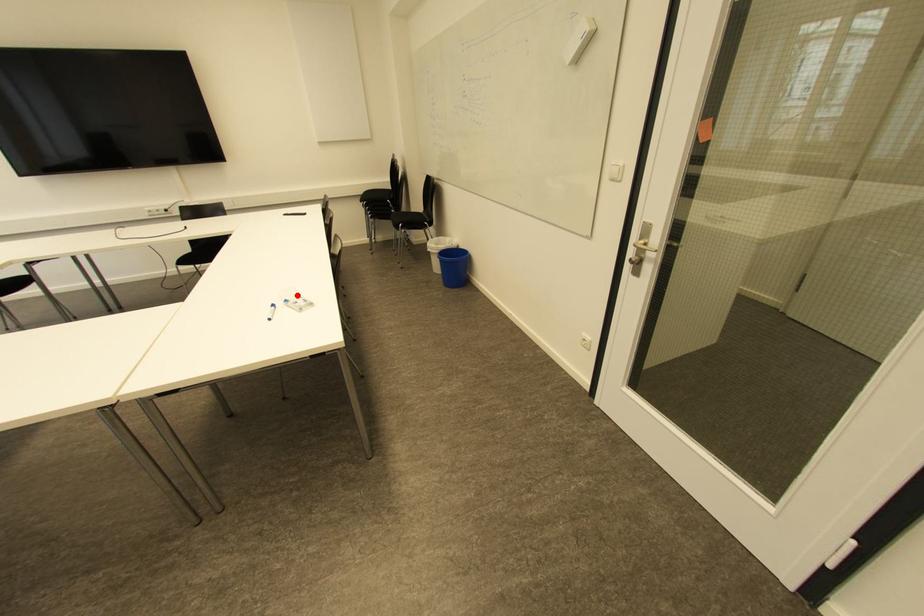
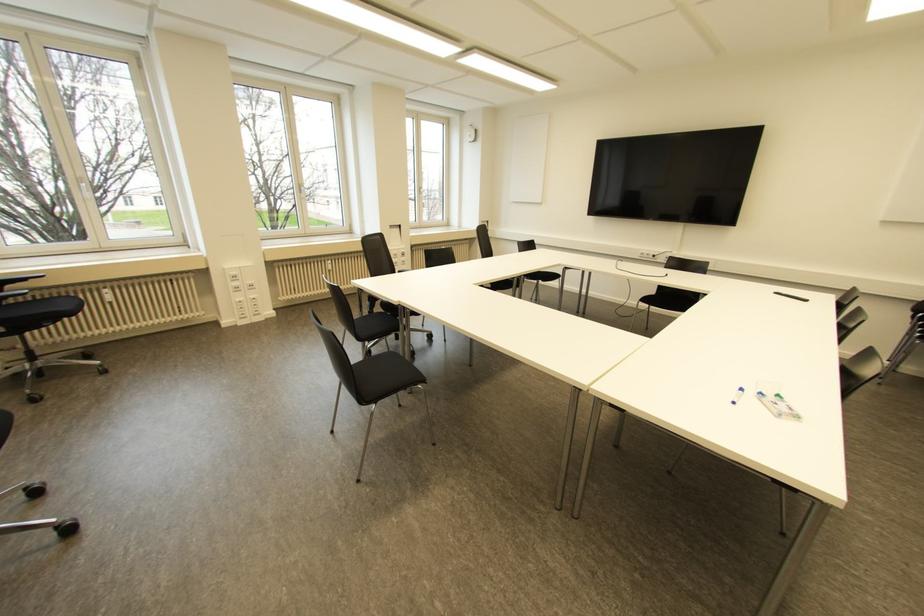
The point at the highlighted location is marked in the first image. Where is the corresponding point in the second image?

(777, 395)